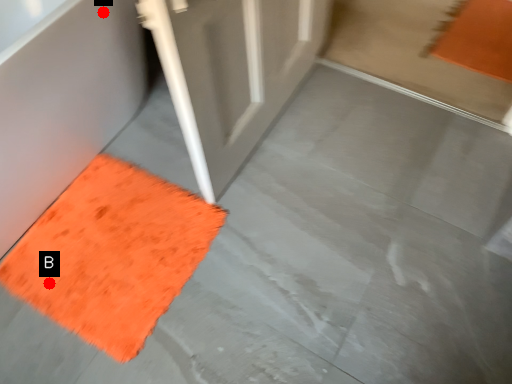
Question: Two points are circled on the image, labeled by A and B beside each circle. Which of the following is the closest to the observer?

Choices:
 (A) A is closer
 (B) B is closer

Answer: (A)